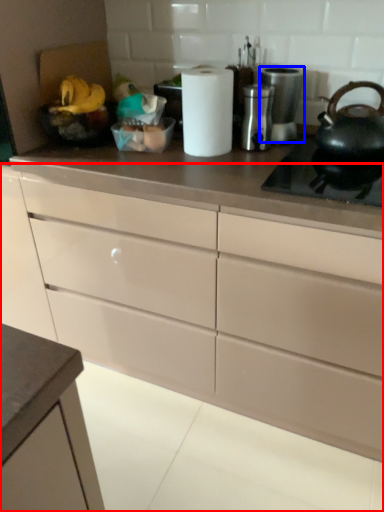
Question: Among these objects, which one is farthest to the camera, cabinetry (highlighted by a red box) or appliance (highlighted by a blue box)?

Choices:
 (A) cabinetry
 (B) appliance

Answer: (B)